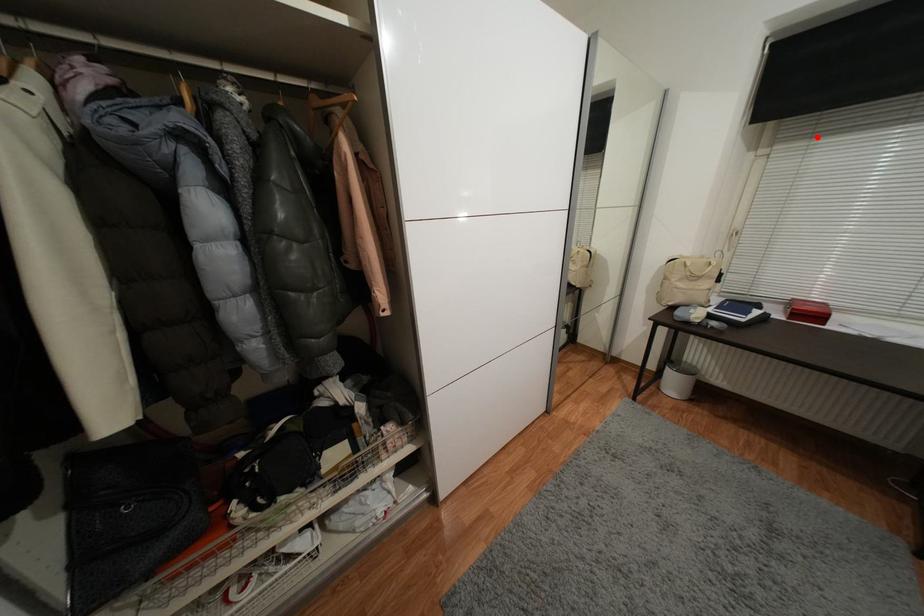
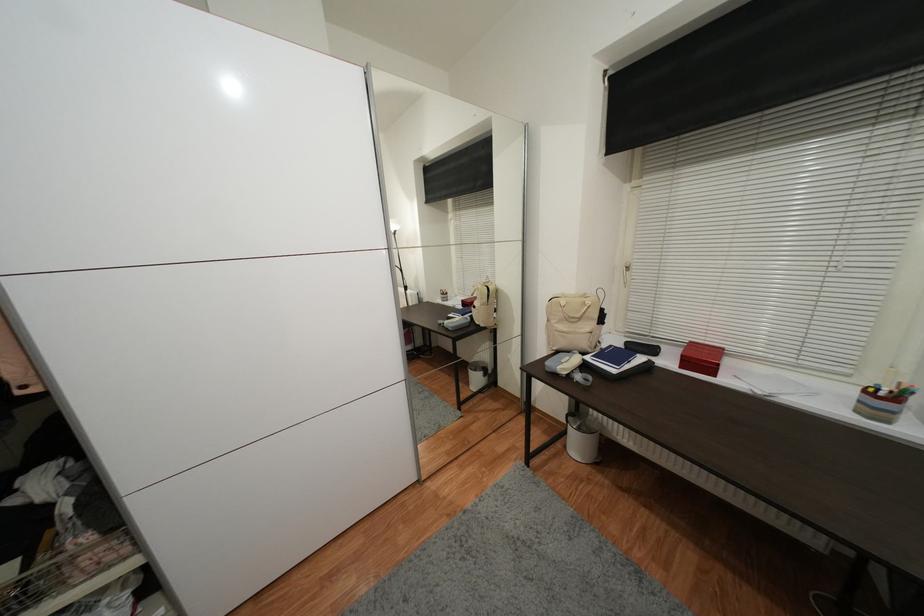
Question: I am providing you with two images of the same scene from different viewpoints. A red point is marked on the first image. Is the red point's position out of view in image 2?

Choices:
 (A) Yes
 (B) No

Answer: (B)